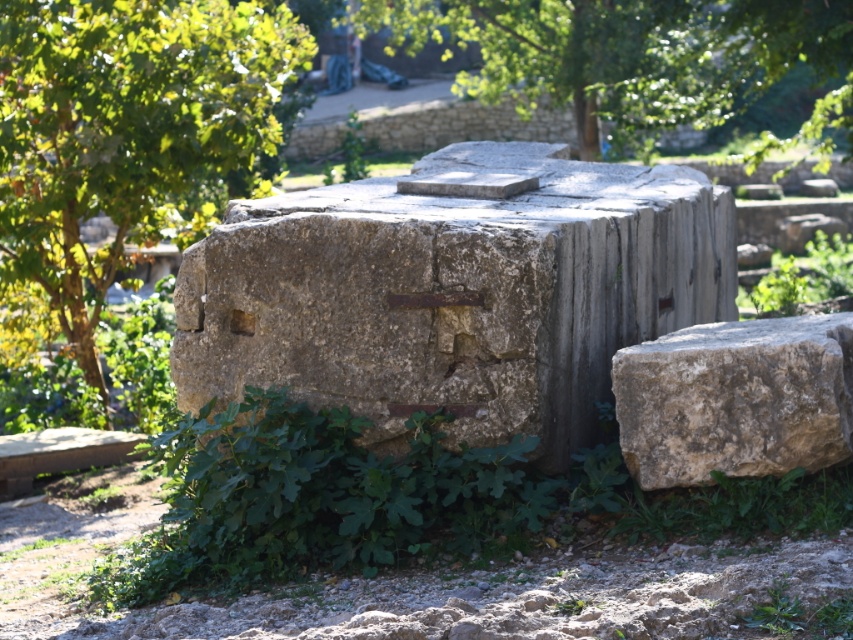
Which is behind, point (397, 211) or point (671, 406)?

Point (397, 211)

What do you see at coordinates (456, 291) in the screenshot?
I see `rusty stone millstone at center` at bounding box center [456, 291].

What do you see at coordinates (456, 291) in the screenshot? I see `rusty stone millstone at center` at bounding box center [456, 291].

Identify the location of rusty stone millstone at center. The image size is (853, 640). (456, 291).

Can you confirm if rusty stone millstone at center is positioned to the right of green leafy tree at upper center?

In fact, rusty stone millstone at center is to the left of green leafy tree at upper center.

This screenshot has width=853, height=640. Describe the element at coordinates (456, 291) in the screenshot. I see `rusty stone millstone at center` at that location.

This screenshot has height=640, width=853. Find the location of `rusty stone millstone at center`. rusty stone millstone at center is located at coordinates (456, 291).

Is green leafy tree at lower left closer to the viewer compared to green leafy tree at upper center?

Yes, green leafy tree at lower left is closer to the viewer.

What do you see at coordinates (125, 131) in the screenshot?
I see `green leafy tree at lower left` at bounding box center [125, 131].

Between point (99, 276) and point (619, 60), which one is positioned in front?

Point (99, 276) is in front.

Locate an element on the screen. Image resolution: width=853 pixels, height=640 pixels. green leafy tree at lower left is located at coordinates (125, 131).